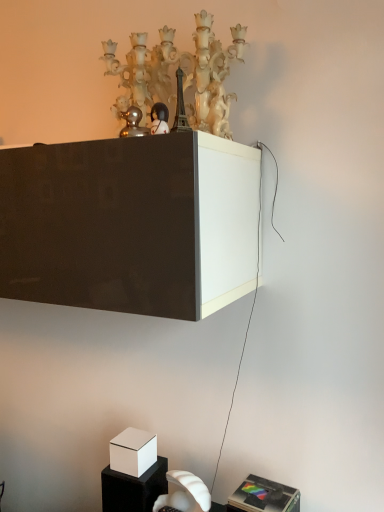
Question: From a real-world perspective, is matte black figurine at upper center located higher than metallic silver speaker at lower right, the 1th furniture when ordered from front to back?

Choices:
 (A) yes
 (B) no

Answer: (A)

Question: Does matte black figurine at upper center lie behind metallic silver speaker at lower right, which appears as the second furniture when viewed from the left?

Choices:
 (A) no
 (B) yes

Answer: (A)

Question: Is matte black figurine at upper center closer to camera compared to metallic silver speaker at lower right, positioned as the 1th furniture in right-to-left order?

Choices:
 (A) no
 (B) yes

Answer: (B)

Question: Considering the relative sizes of matte black figurine at upper center and metallic silver speaker at lower right, which appears as the second furniture when viewed from the left, in the image provided, is matte black figurine at upper center smaller than metallic silver speaker at lower right, which appears as the second furniture when viewed from the left,?

Choices:
 (A) no
 (B) yes

Answer: (B)

Question: From the image's perspective, would you say matte black figurine at upper center is shown under metallic silver speaker at lower right, the 1th furniture when ordered from front to back?

Choices:
 (A) no
 (B) yes

Answer: (A)

Question: Is matte black figurine at upper center wider than metallic silver speaker at lower right, acting as the 2th furniture starting from the back?

Choices:
 (A) yes
 (B) no

Answer: (B)

Question: Is white matte cube at lower left, which is the first furniture from left to right, not close to matte white chandelier at upper center?

Choices:
 (A) yes
 (B) no

Answer: (A)

Question: Considering the relative positions of white matte cube at lower left, placed as the second furniture when sorted from front to back, and matte white chandelier at upper center in the image provided, is white matte cube at lower left, placed as the second furniture when sorted from front to back, to the right of matte white chandelier at upper center from the viewer's perspective?

Choices:
 (A) no
 (B) yes

Answer: (A)

Question: Is white matte cube at lower left, placed as the second furniture when sorted from front to back, closer to the viewer compared to matte white chandelier at upper center?

Choices:
 (A) yes
 (B) no

Answer: (B)

Question: Is white matte cube at lower left, which is the first furniture from left to right, outside matte white chandelier at upper center?

Choices:
 (A) yes
 (B) no

Answer: (A)

Question: Is white matte cube at lower left, which is counted as the first furniture, starting from the back, facing towards matte white chandelier at upper center?

Choices:
 (A) no
 (B) yes

Answer: (A)

Question: Considering the relative sizes of white matte cube at lower left, which is the first furniture from left to right, and matte white chandelier at upper center in the image provided, is white matte cube at lower left, which is the first furniture from left to right, taller than matte white chandelier at upper center?

Choices:
 (A) yes
 (B) no

Answer: (B)

Question: Is matte white chandelier at upper center to the right of matte black figurine at upper center from the viewer's perspective?

Choices:
 (A) no
 (B) yes

Answer: (B)